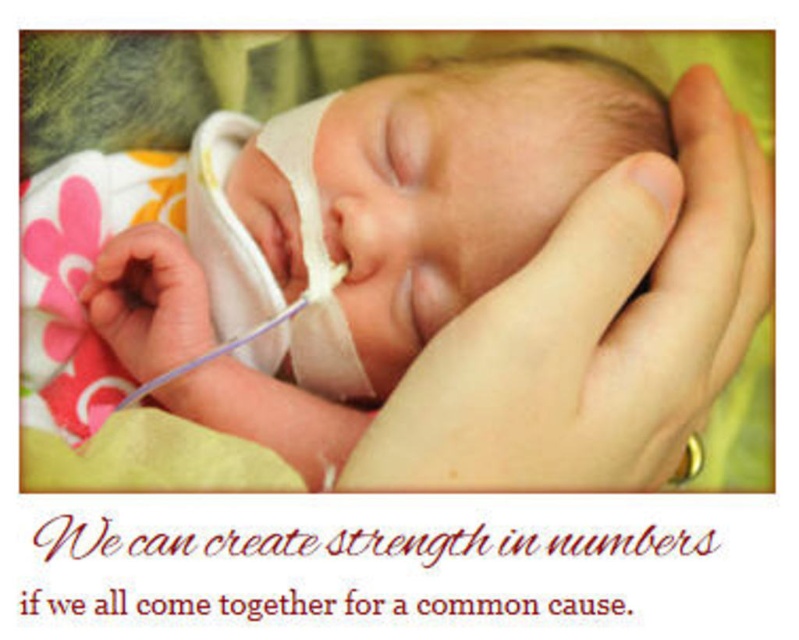
Question: Which of these objects is positioned farthest from the rubber teething ring at lower right?

Choices:
 (A) smooth skin hand at center
 (B) smooth skin newborn at center

Answer: (B)

Question: Which of the following is the closest to the observer?

Choices:
 (A) smooth skin newborn at center
 (B) rubber teething ring at lower right
 (C) smooth skin hand at center

Answer: (C)

Question: Does smooth skin hand at center come in front of rubber teething ring at lower right?

Choices:
 (A) no
 (B) yes

Answer: (B)

Question: Which point is farther to the camera?

Choices:
 (A) [x=364, y=445]
 (B) [x=702, y=456]

Answer: (B)

Question: Observing the image, what is the correct spatial positioning of smooth skin newborn at center in reference to rubber teething ring at lower right?

Choices:
 (A) above
 (B) below

Answer: (A)

Question: Can you confirm if smooth skin newborn at center is positioned below smooth skin hand at center?

Choices:
 (A) no
 (B) yes

Answer: (A)